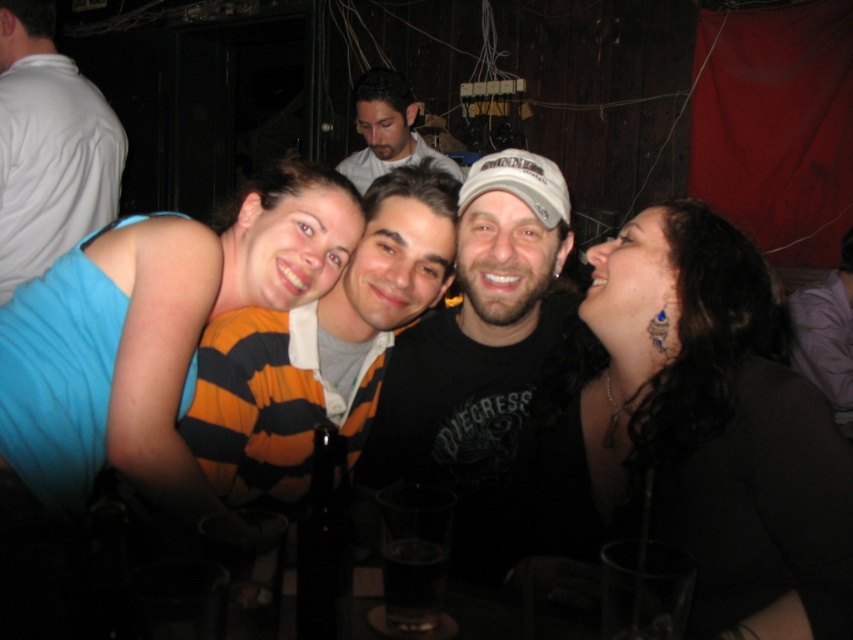
Can you confirm if black matte t-shirt at center is taller than white matte shirt at upper left?

No.

Can you confirm if black matte t-shirt at center is smaller than white matte shirt at upper left?

Actually, black matte t-shirt at center might be larger than white matte shirt at upper left.

Is point (514, 435) closer to camera compared to point (68, 64)?

Yes, point (514, 435) is in front of point (68, 64).

Find the location of `black matte t-shirt at center`. black matte t-shirt at center is located at coordinates (480, 358).

Is point (840, 417) in front of point (367, 154)?

That is True.

Which of these two, purple fabric shirt at right or smooth gray shirt at center, stands shorter?

With less height is smooth gray shirt at center.

Locate an element on the screen. purple fabric shirt at right is located at coordinates (827, 333).

Is black matte hair at upper right taller than black matte t-shirt at center?

In fact, black matte hair at upper right may be shorter than black matte t-shirt at center.

Measure the distance from black matte hair at upper right to black matte t-shirt at center.

They are 9.20 inches apart.

Is point (685, 433) less distant than point (509, 248)?

Yes, point (685, 433) is in front of point (509, 248).

The width and height of the screenshot is (853, 640). In order to click on black matte hair at upper right in this screenshot , I will do `click(698, 429)`.